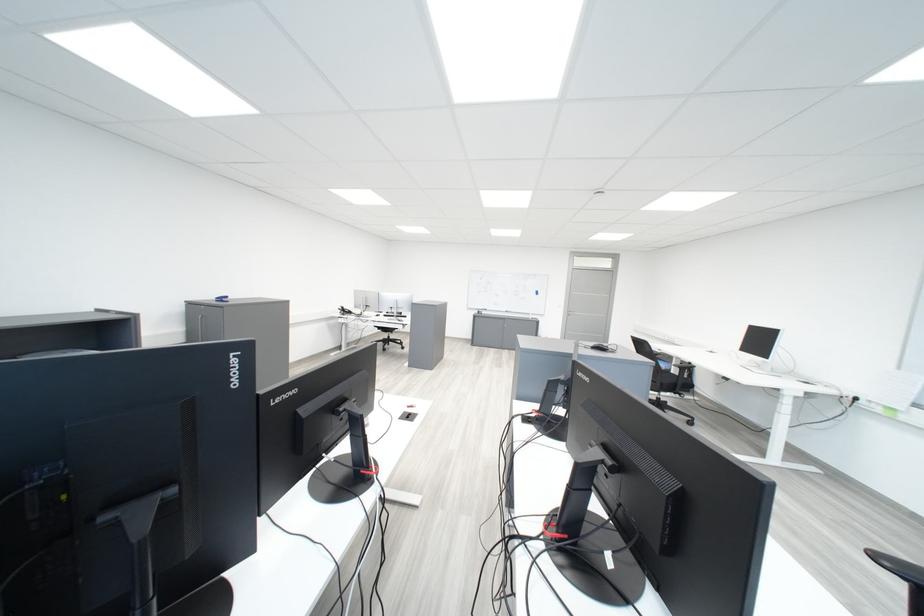
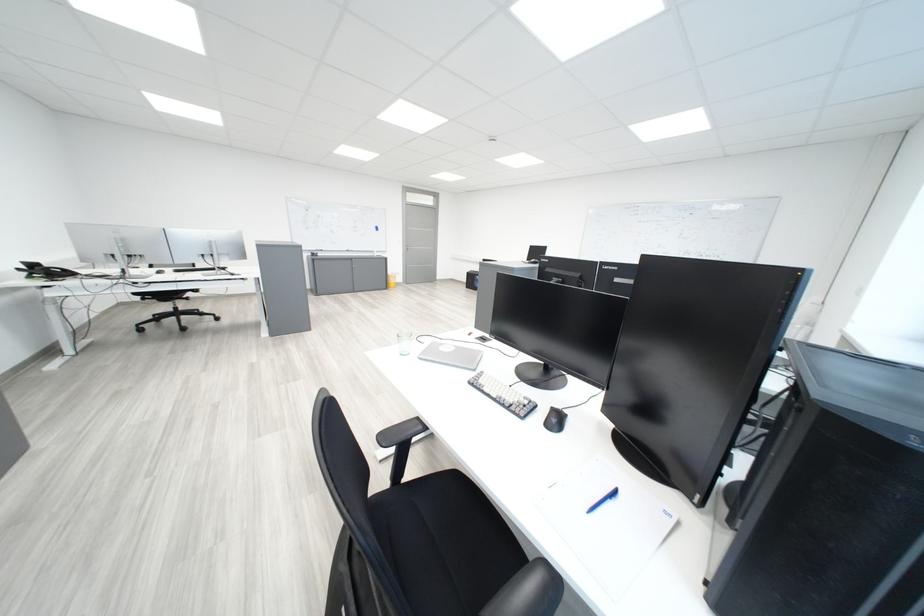
Locate, in the second image, the point that corresponds to [358,313] in the first image.

(59, 275)